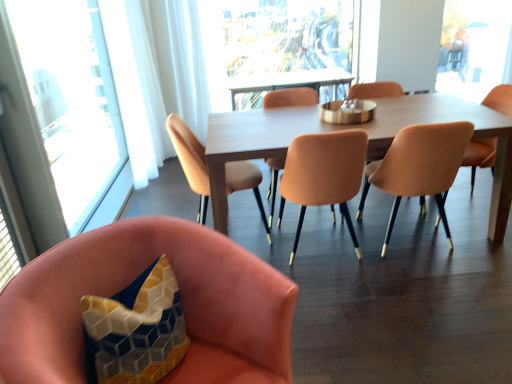
Find the location of a particular element. free location in front of light brown wooden table at center is located at coordinates (397, 305).